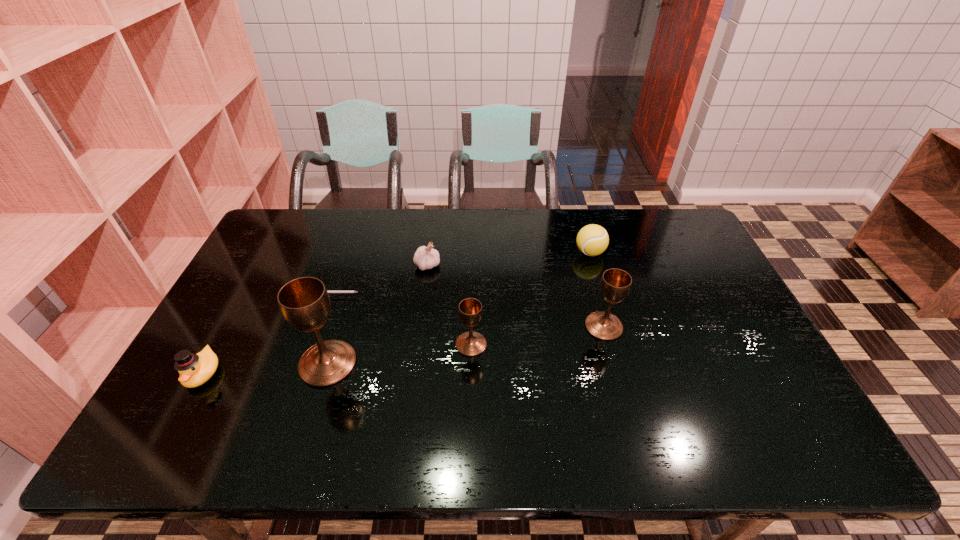
Find the location of `free space between the rightmost chalice and the fifth shortest object`. free space between the rightmost chalice and the fifth shortest object is located at coordinates point(538,335).

Identify the location of vacant space in between the tallest object and the fourth object from left to right. (377, 314).

This screenshot has width=960, height=540. What are the coordinates of `empty location between the garlic and the tennis ball` in the screenshot? It's located at (509, 259).

At what (x,y) coordinates should I click in order to perform the action: click on free space between the rightmost chalice and the shortest chalice. Please return your answer as a coordinate pair (x, y). Looking at the image, I should click on (538, 335).

This screenshot has width=960, height=540. Identify the location of free space that is in between the third tallest object and the second tallest object. (538, 335).

Image resolution: width=960 pixels, height=540 pixels. Find the location of `blank region between the second chalice from right to left and the rightmost chalice`. blank region between the second chalice from right to left and the rightmost chalice is located at coordinates (538, 335).

Where is `object that stands as the closest to the leftmost chalice`? This screenshot has width=960, height=540. object that stands as the closest to the leftmost chalice is located at coordinates (327, 291).

Locate which object is the sixth closest to the garlic. Please provide its 2D coordinates. Your answer should be formatted as a tuple, i.e. [(x, y)], where the tuple contains the x and y coordinates of a point satisfying the conditions above.

[(195, 369)]

Identify which chalice is located as the third nearest to the third farthest object. Please provide its 2D coordinates. Your answer should be formatted as a tuple, i.e. [(x, y)], where the tuple contains the x and y coordinates of a point satisfying the conditions above.

[(615, 284)]

Identify which chalice is located as the nearest to the tennis ball. Please provide its 2D coordinates. Your answer should be formatted as a tuple, i.e. [(x, y)], where the tuple contains the x and y coordinates of a point satisfying the conditions above.

[(615, 284)]